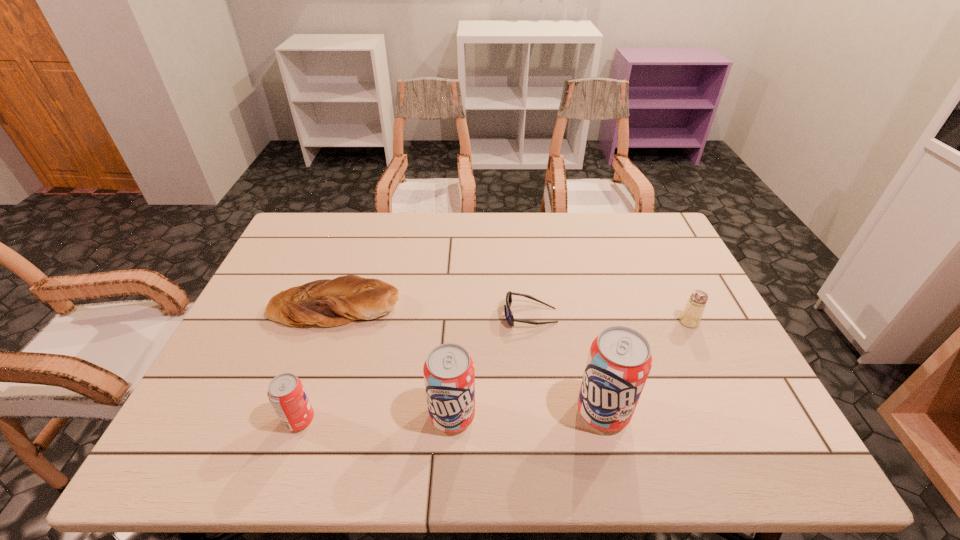
Where is `the shortest soda can`? The height and width of the screenshot is (540, 960). the shortest soda can is located at coordinates (286, 393).

You are a GUI agent. You are given a task and a screenshot of the screen. Output one action in this format:
    pyautogui.click(x=<x>, y=<y>)
    Task: Click on the third tallest object
    This screenshot has height=540, width=960.
    Given the screenshot: What is the action you would take?
    pyautogui.click(x=286, y=393)

At what (x,y) coordinates should I click in order to perform the action: click on the fourth object from right to left. Please return your answer as a coordinate pair (x, y). The width and height of the screenshot is (960, 540). Looking at the image, I should click on (449, 374).

Identify the location of the second shortest soda can. (449, 374).

The height and width of the screenshot is (540, 960). I want to click on the rightmost soda can, so click(619, 361).

Find the location of `sunglasses`. sunglasses is located at coordinates click(509, 316).

Find the location of a particular element. This screenshot has height=540, width=960. the shortest object is located at coordinates (509, 316).

Identify the location of bread. (325, 302).

Identify the location of the rightmost object. The height and width of the screenshot is (540, 960). (691, 315).

The height and width of the screenshot is (540, 960). I want to click on saltshaker, so click(691, 315).